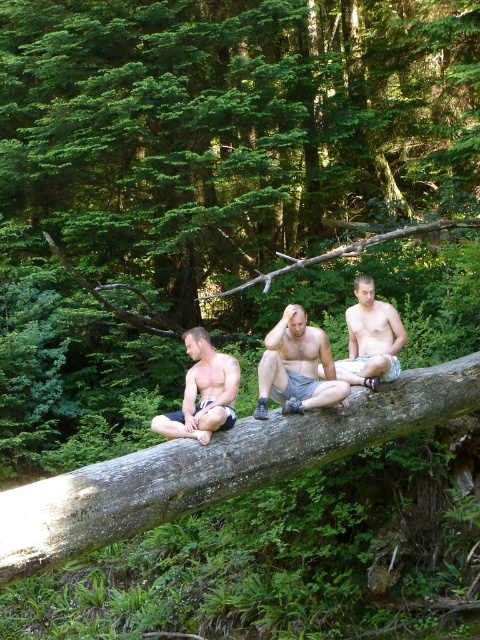
Question: Which point is closer to the camera?

Choices:
 (A) gray rough log at center
 (B) light brown wood log at center
 (C) smooth bark log at center

Answer: (A)

Question: Is smooth bark log at center to the right of shiny metallic shorts at center from the viewer's perspective?

Choices:
 (A) yes
 (B) no

Answer: (B)

Question: Which point appears closest to the camera in this image?

Choices:
 (A) (267, 388)
 (B) (418, 202)
 (C) (226, 400)

Answer: (C)

Question: Can you confirm if smooth bark log at center is positioned below light brown wood log at center?

Choices:
 (A) yes
 (B) no

Answer: (B)

Question: Considering the relative positions of smooth bark log at center and shiny metallic shorts at center in the image provided, where is smooth bark log at center located with respect to shiny metallic shorts at center?

Choices:
 (A) above
 (B) below

Answer: (A)

Question: Estimate the real-world distances between objects in this image. Which object is closer to the smooth bark log at center?

Choices:
 (A) shiny metallic shorts at center
 (B) gray rough log at center

Answer: (A)